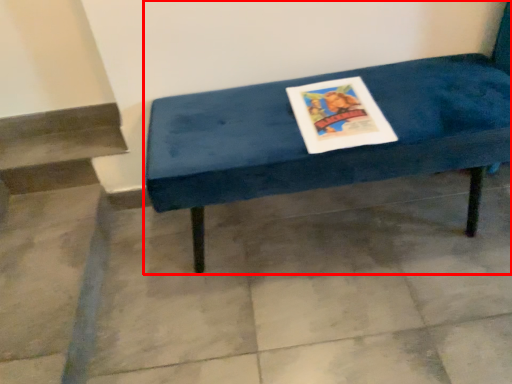
Question: From the image's perspective, what is the correct spatial positioning of furniture (annotated by the red box) in reference to concrete?

Choices:
 (A) above
 (B) below

Answer: (A)